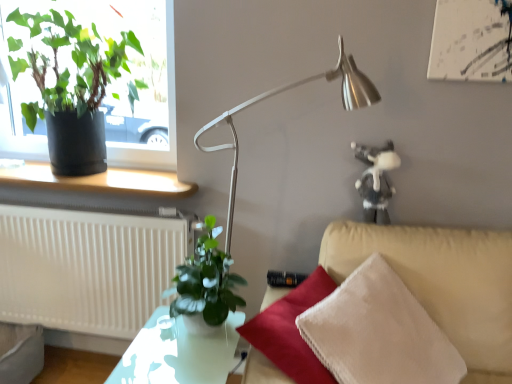
Question: Considering their positions, is green matte plant at center, which is counted as the second houseplant, starting from the back, located in front of or behind matte black window sill at lower left?

Choices:
 (A) behind
 (B) front

Answer: (B)

Question: Visually, is green matte plant at center, positioned as the first houseplant in front-to-back order, positioned to the left or to the right of matte black window sill at lower left?

Choices:
 (A) right
 (B) left

Answer: (A)

Question: Considering the real-world distances, which object is closest to the matte black window sill at lower left?

Choices:
 (A) green matte plant at upper left, which ranks as the first houseplant in top-to-bottom order
 (B) translucent glass table at center
 (C) satin silver lamp at center
 (D) green matte plant at center, which is counted as the 1th houseplant, starting from the bottom
 (E) white textured radiator at lower left

Answer: (E)

Question: Which object is the closest to the green matte plant at center, positioned as the first houseplant in front-to-back order?

Choices:
 (A) white textured radiator at lower left
 (B) translucent glass table at center
 (C) green matte plant at upper left, the second houseplant in the right-to-left sequence
 (D) satin silver lamp at center
 (E) matte black window sill at lower left

Answer: (B)